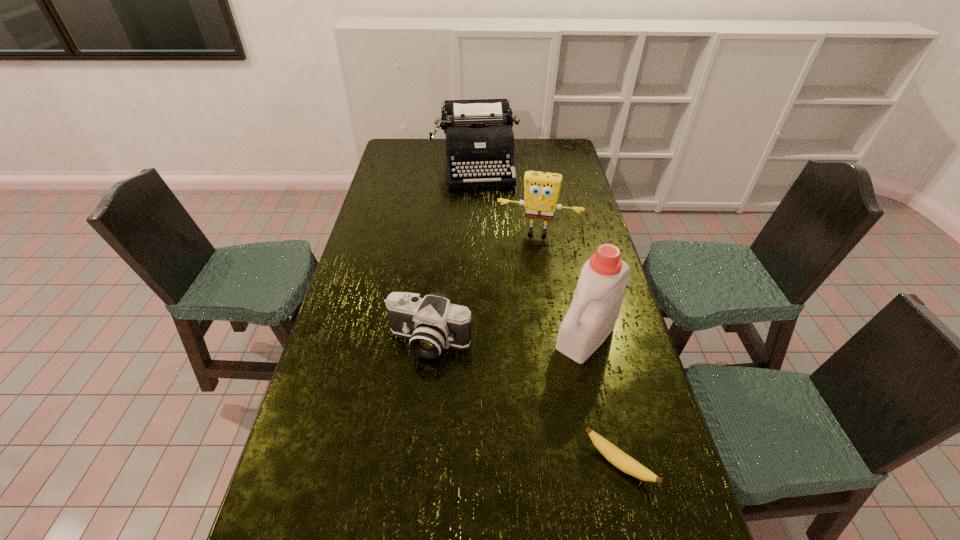
The width and height of the screenshot is (960, 540). In order to click on free space located 0.270m on the face of the second farthest object in this screenshot , I will do click(x=522, y=289).

In order to click on vacant space situated 0.210m on the typing side of the farthest object in this screenshot , I will do `click(483, 219)`.

The height and width of the screenshot is (540, 960). Identify the location of free space located on the typing side of the farthest object. (485, 237).

Identify the location of vacant space located 0.350m on the typing side of the farthest object. (486, 240).

In order to click on free point located on the handle side of the detergent in this screenshot , I will do `click(557, 370)`.

The width and height of the screenshot is (960, 540). In order to click on blank space located 0.280m on the handle side of the detergent in this screenshot , I will do `click(510, 424)`.

Locate an element on the screen. free space located on the handle side of the detergent is located at coordinates (547, 382).

At what (x,y) coordinates should I click in order to perform the action: click on object at the far edge. Please return your answer as a coordinate pair (x, y). Looking at the image, I should click on (479, 137).

At what (x,y) coordinates should I click in order to perform the action: click on object located in the near edge section of the desktop. Please return your answer as a coordinate pair (x, y). Image resolution: width=960 pixels, height=540 pixels. Looking at the image, I should click on (613, 454).

Identify the location of banana that is at the right edge. (x=613, y=454).